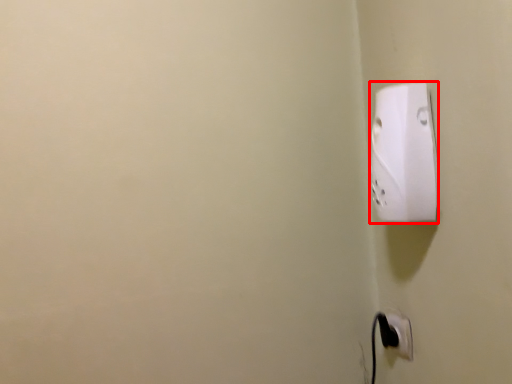
Question: Considering the relative positions of power plugs and sockets (annotated by the red box) and power plugs and sockets in the image provided, where is power plugs and sockets (annotated by the red box) located with respect to the staircase?

Choices:
 (A) right
 (B) left

Answer: (B)